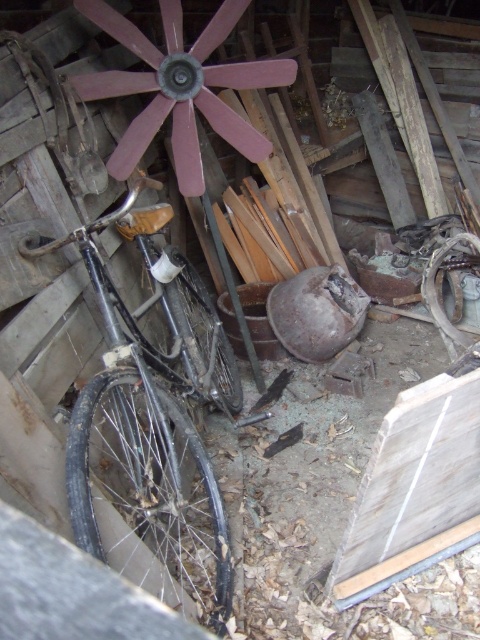
You are organizing items in the storage area and need to move the black matte bicycle at left. To access it, you must first move the rusty metal wagon wheel at center. Is the wagon wheel blocking the bicycle?

The black matte bicycle at left is located below the rusty metal wagon wheel at center, so the wagon wheel is blocking the bicycle. You must move the wagon wheel first to access the bicycle.

You are a painter standing 1.5 meters away from the rustic metal wagon wheel at center. Can you reach it with a 0.3 meter long brush?

The rustic metal wagon wheel at center is 1.35 meters from viewer. Since you are standing 1.5 meters away, the distance between you and the wheel is 0.15 meters. With a 0.3 meter long brush, you can easily reach the wheel.

You are organizing items in the storage area. You need to place the black matte bicycle at left and the rusty metal wagon wheel at center side by side. Which item requires more horizontal space to fit properly?

The black matte bicycle at left requires more horizontal space because its width surpasses that of the rusty metal wagon wheel at center.